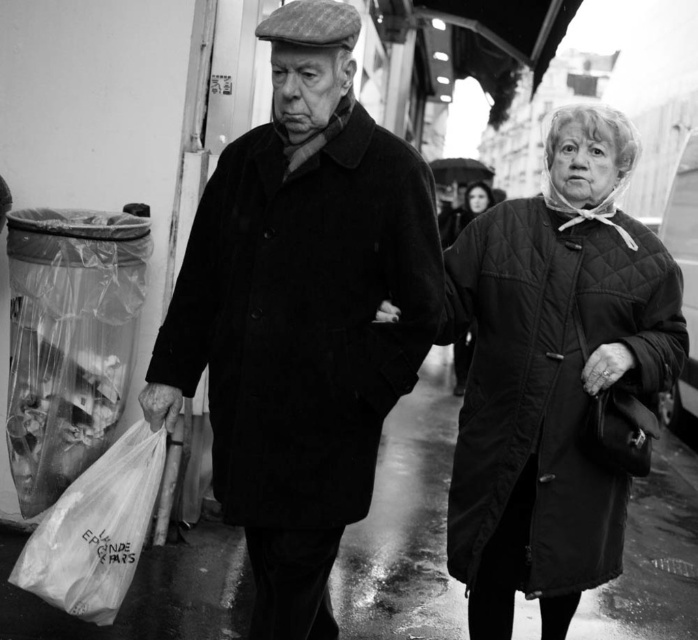
Question: Considering the real-world distances, which object is closest to the quilted black coat at center?

Choices:
 (A) wet asphalt at center
 (B) quilted black coat at right
 (C) matte black coat at center

Answer: (A)

Question: Which point is closer to the camera?

Choices:
 (A) white plastic bag at lower left
 (B) quilted black coat at right

Answer: (A)

Question: Which of these objects is positioned closest to the matte black coat at center?

Choices:
 (A) wet asphalt at center
 (B) quilted black coat at right
 (C) black matte umbrella at upper center
 (D) quilted black coat at center

Answer: (B)

Question: Does quilted black coat at right appear on the left side of quilted black coat at center?

Choices:
 (A) no
 (B) yes

Answer: (B)

Question: Can you confirm if quilted black coat at right is positioned to the left of white plastic bag at lower left?

Choices:
 (A) yes
 (B) no

Answer: (B)

Question: Is wet asphalt at center to the right of white plastic bag at lower left from the viewer's perspective?

Choices:
 (A) no
 (B) yes

Answer: (B)